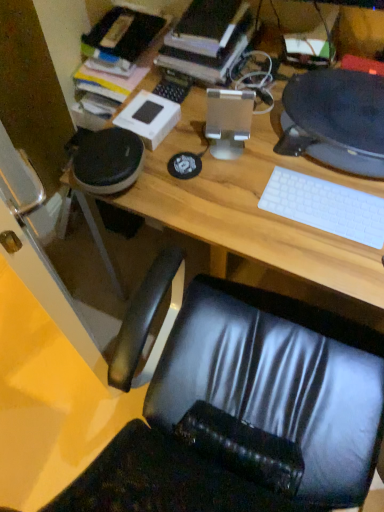
You are a GUI agent. You are given a task and a screenshot of the screen. Output one action in this format:
    pyautogui.click(x=<x>, y=<y>)
    Task: Click on the satin silver desktop computer at center, which ranks as the first desktop computer in left-to-right order
    
    Given the screenshot: What is the action you would take?
    pyautogui.click(x=228, y=121)

How much space does satin silver desktop computer at center, which is the 2th desktop computer from right to left, occupy vertically?

satin silver desktop computer at center, which is the 2th desktop computer from right to left, is 17.52 centimeters tall.

Image resolution: width=384 pixels, height=512 pixels. What do you see at coordinates (208, 39) in the screenshot?
I see `hardcover book at upper center` at bounding box center [208, 39].

What is the approximate width of white matte keyboard at right?

The width of white matte keyboard at right is 5.10 inches.

Identify the location of satin silver desktop computer at center, which is the 2th desktop computer from right to left. (228, 121).

From the image's perspective, would you say wooden desk at center is shown under white matte keyboard at right?

Yes, from the image's perspective, wooden desk at center is below white matte keyboard at right.

Locate an element on the screen. keyboard above the wooden desk at center (from the image's perspective) is located at coordinates (325, 206).

From a real-world perspective, is wooden desk at center above or below white matte keyboard at right?

Clearly, from a real-world perspective, wooden desk at center is below white matte keyboard at right.

Does point (323, 200) lie in front of point (315, 132)?

Yes, point (323, 200) is in front of point (315, 132).

Between white matte keyboard at right and matte black desktop computer at upper right, which ranks as the second desktop computer in left-to-right order, which one has less height?

white matte keyboard at right.

Looking at the image, does white matte keyboard at right seem bigger or smaller compared to matte black desktop computer at upper right, which ranks as the second desktop computer in left-to-right order?

Considering their sizes, white matte keyboard at right takes up less space than matte black desktop computer at upper right, which ranks as the second desktop computer in left-to-right order.

Could you tell me if white matte keyboard at right is facing matte black desktop computer at upper right, which ranks as the second desktop computer in left-to-right order?

No, white matte keyboard at right does not turn towards matte black desktop computer at upper right, which ranks as the second desktop computer in left-to-right order.

Is white matte keyboard at right taller than satin silver desktop computer at center, which is the 2th desktop computer from right to left?

Incorrect, the height of white matte keyboard at right is not larger of that of satin silver desktop computer at center, which is the 2th desktop computer from right to left.

Considering the points (308, 217) and (217, 132), which point is behind, point (308, 217) or point (217, 132)?

The point (217, 132) is farther.

How different are the orientations of white matte keyboard at right and satin silver desktop computer at center, which ranks as the first desktop computer in left-to-right order, in degrees?

The angular difference between white matte keyboard at right and satin silver desktop computer at center, which ranks as the first desktop computer in left-to-right order, is 15.2 degrees.

Considering the relative sizes of white matte keyboard at right and satin silver desktop computer at center, which is the 2th desktop computer from right to left, in the image provided, is white matte keyboard at right thinner than satin silver desktop computer at center, which is the 2th desktop computer from right to left,?

No, white matte keyboard at right is not thinner than satin silver desktop computer at center, which is the 2th desktop computer from right to left.

How distant is white matte keyboard at right from hardcover book at upper center?

They are 18.50 inches apart.

Considering the sizes of objects white matte keyboard at right and hardcover book at upper center in the image provided, who is bigger, white matte keyboard at right or hardcover book at upper center?

hardcover book at upper center is bigger.

Are white matte keyboard at right and hardcover book at upper center far apart?

No, white matte keyboard at right is in close proximity to hardcover book at upper center.

Is white matte keyboard at right positioned before hardcover book at upper center?

Yes, it is in front of hardcover book at upper center.

Is wooden desk at center to the right of hardcover book at upper center from the viewer's perspective?

Yes, wooden desk at center is to the right of hardcover book at upper center.

Would you consider wooden desk at center to be distant from hardcover book at upper center?

No, wooden desk at center is not far from hardcover book at upper center.

From the image's perspective, which one is positioned higher, wooden desk at center or hardcover book at upper center?

hardcover book at upper center, from the image's perspective.

In terms of width, does wooden desk at center look wider or thinner when compared to hardcover book at upper center?

wooden desk at center is wider than hardcover book at upper center.

Which object is more forward, satin silver desktop computer at center, which is the 2th desktop computer from right to left, or wooden desk at center?

wooden desk at center.

Does satin silver desktop computer at center, which ranks as the first desktop computer in left-to-right order, appear on the left side of wooden desk at center?

Correct, you'll find satin silver desktop computer at center, which ranks as the first desktop computer in left-to-right order, to the left of wooden desk at center.

Which is nearer, (248, 119) or (318, 173)?

The point (318, 173) is closer.

In the scene shown: Is satin silver desktop computer at center, which ranks as the first desktop computer in left-to-right order, located outside wooden desk at center?

That's correct, satin silver desktop computer at center, which ranks as the first desktop computer in left-to-right order, is outside of wooden desk at center.

Considering the sizes of hardcover book at upper center and satin silver desktop computer at center, which is the 2th desktop computer from right to left, in the image, is hardcover book at upper center wider or thinner than satin silver desktop computer at center, which is the 2th desktop computer from right to left,?

Considering their sizes, hardcover book at upper center looks broader than satin silver desktop computer at center, which is the 2th desktop computer from right to left.

Which is more to the right, hardcover book at upper center or satin silver desktop computer at center, which is the 2th desktop computer from right to left?

satin silver desktop computer at center, which is the 2th desktop computer from right to left.

Can you see hardcover book at upper center touching satin silver desktop computer at center, which is the 2th desktop computer from right to left?

They are not placed beside each other.

From a real-world perspective, is hardcover book at upper center positioned under satin silver desktop computer at center, which ranks as the first desktop computer in left-to-right order, based on gravity?

Incorrect, from a real-world perspective, hardcover book at upper center is higher than satin silver desktop computer at center, which ranks as the first desktop computer in left-to-right order.

Image resolution: width=384 pixels, height=512 pixels. I want to click on desk below the white matte keyboard at right (from a real-world perspective), so click(x=259, y=217).

Find the location of `keyboard on the left of matte black desktop computer at upper right, which appears as the first desktop computer when viewed from the right`. keyboard on the left of matte black desktop computer at upper right, which appears as the first desktop computer when viewed from the right is located at coordinates (325, 206).

Estimate the real-world distances between objects in this image. Which object is closer to satin silver desktop computer at center, which ranks as the first desktop computer in left-to-right order, wooden desk at center or white matte keyboard at right?

wooden desk at center is positioned closer to the anchor satin silver desktop computer at center, which ranks as the first desktop computer in left-to-right order.

Estimate the real-world distances between objects in this image. Which object is further from satin silver desktop computer at center, which ranks as the first desktop computer in left-to-right order, white matte keyboard at right or matte black desktop computer at upper right, which ranks as the second desktop computer in left-to-right order?

Based on the image, white matte keyboard at right appears to be further to satin silver desktop computer at center, which ranks as the first desktop computer in left-to-right order.

When comparing their distances from hardcover book at upper center, does matte black desktop computer at upper right, which appears as the first desktop computer when viewed from the right, or wooden desk at center seem closer?

Among the two, wooden desk at center is located nearer to hardcover book at upper center.

Estimate the real-world distances between objects in this image. Which object is closer to matte black desktop computer at upper right, which appears as the first desktop computer when viewed from the right, satin silver desktop computer at center, which is the 2th desktop computer from right to left, or white matte keyboard at right?

Among the two, white matte keyboard at right is located nearer to matte black desktop computer at upper right, which appears as the first desktop computer when viewed from the right.

From the image, which object appears to be farther from hardcover book at upper center, wooden desk at center or satin silver desktop computer at center, which is the 2th desktop computer from right to left?

Based on the image, wooden desk at center appears to be further to hardcover book at upper center.

Looking at the image, which one is located closer to white matte keyboard at right, hardcover book at upper center or satin silver desktop computer at center, which ranks as the first desktop computer in left-to-right order?

satin silver desktop computer at center, which ranks as the first desktop computer in left-to-right order.

From the image, which object appears to be farther from matte black desktop computer at upper right, which ranks as the second desktop computer in left-to-right order, hardcover book at upper center or white matte keyboard at right?

Based on the image, hardcover book at upper center appears to be further to matte black desktop computer at upper right, which ranks as the second desktop computer in left-to-right order.

Considering their positions, is hardcover book at upper center positioned further to white matte keyboard at right than matte black desktop computer at upper right, which appears as the first desktop computer when viewed from the right?

Among the two, hardcover book at upper center is located further to white matte keyboard at right.

At what (x,y) coordinates should I click in order to perform the action: click on keyboard between hardcover book at upper center and wooden desk at center vertically. Please return your answer as a coordinate pair (x, y). Looking at the image, I should click on (325, 206).

This screenshot has height=512, width=384. Find the location of `keyboard situated between satin silver desktop computer at center, which ranks as the first desktop computer in left-to-right order, and matte black desktop computer at upper right, which ranks as the second desktop computer in left-to-right order, from left to right`. keyboard situated between satin silver desktop computer at center, which ranks as the first desktop computer in left-to-right order, and matte black desktop computer at upper right, which ranks as the second desktop computer in left-to-right order, from left to right is located at coordinates (325, 206).

The image size is (384, 512). In order to click on keyboard situated between satin silver desktop computer at center, which ranks as the first desktop computer in left-to-right order, and wooden desk at center from left to right in this screenshot , I will do [x=325, y=206].

Identify the location of desk situated between satin silver desktop computer at center, which ranks as the first desktop computer in left-to-right order, and matte black desktop computer at upper right, which ranks as the second desktop computer in left-to-right order, from left to right. (259, 217).